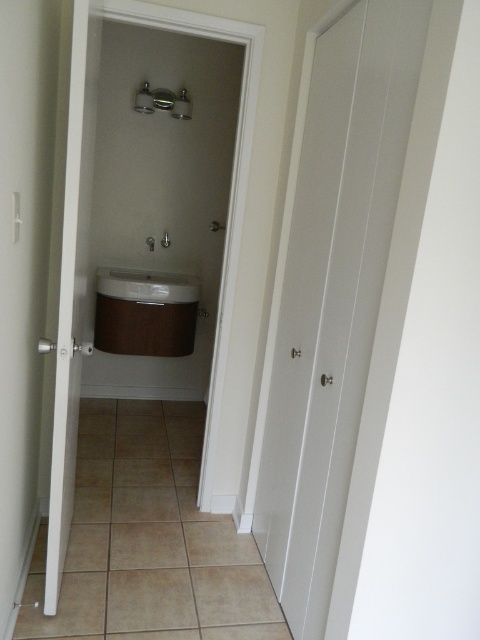
Does white glossy sink at center appear on the right side of metallic silver shower at upper center?

No, white glossy sink at center is not to the right of metallic silver shower at upper center.

Which of these two, white glossy sink at center or metallic silver shower at upper center, stands taller?

white glossy sink at center is taller.

Does point (181, 282) come in front of point (176, 113)?

No, (181, 282) is further to viewer.

This screenshot has height=640, width=480. Identify the location of white glossy sink at center. (146, 285).

This screenshot has height=640, width=480. Describe the element at coordinates (144, 312) in the screenshot. I see `wooden sink at center` at that location.

Is wooden sink at center bigger than white glossy sink at center?

Correct, wooden sink at center is larger in size than white glossy sink at center.

Is point (162, 296) farther from camera compared to point (187, 292)?

No, (162, 296) is closer to viewer.

At what (x,y) coordinates should I click in order to perform the action: click on wooden sink at center. Please return your answer as a coordinate pair (x, y). This screenshot has width=480, height=640. Looking at the image, I should click on (144, 312).

Is wooden sink at center further to camera compared to metallic silver shower at upper center?

That is True.

Is wooden sink at center shorter than metallic silver shower at upper center?

No, wooden sink at center is not shorter than metallic silver shower at upper center.

Locate an element on the screen. The image size is (480, 640). wooden sink at center is located at coordinates coord(144,312).